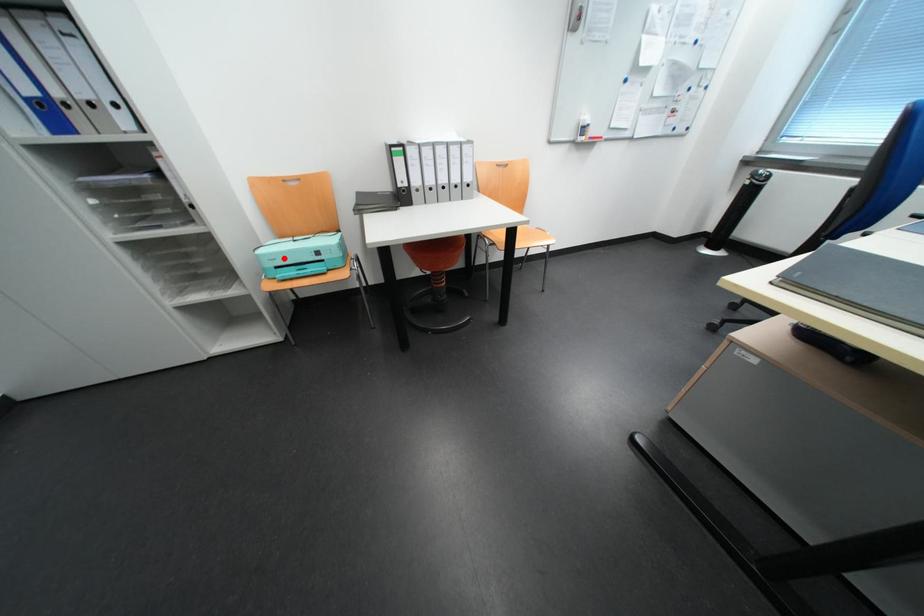
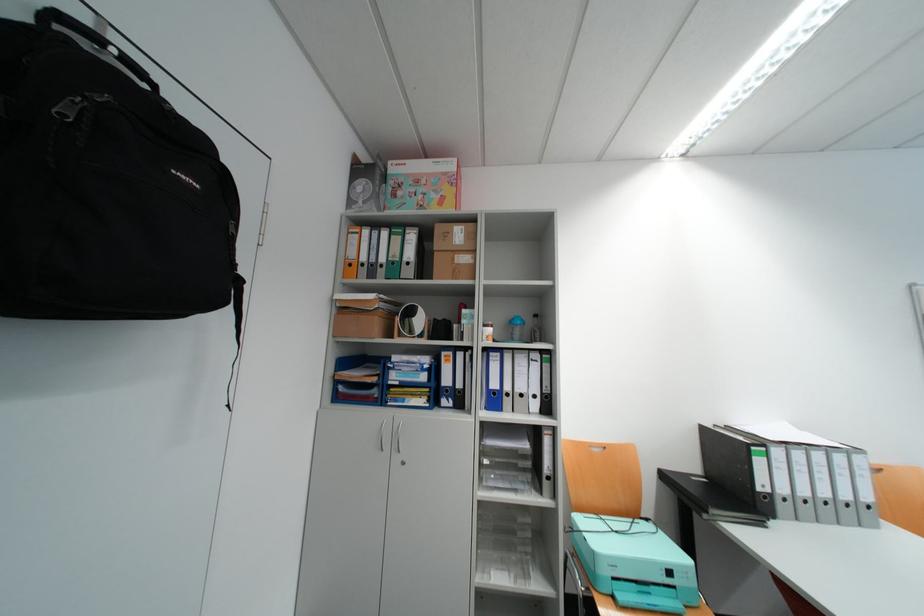
Question: A red point is marked in image1. In image2, is the corresponding 3D point closer to the camera or farther? Reply with the corresponding letter.

Choices:
 (A) The corresponding 3D point is closer.
 (B) The corresponding 3D point is farther.

Answer: (B)